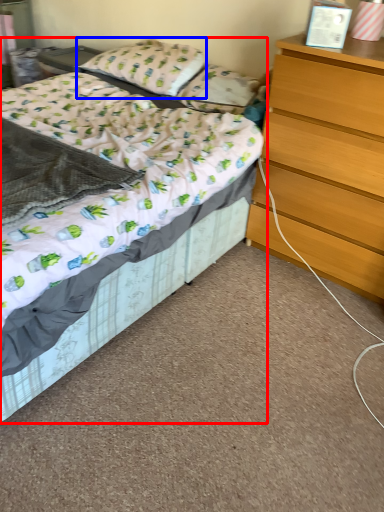
Question: Which of the following is the closest to the observer, bed (highlighted by a red box) or pillow (highlighted by a blue box)?

Choices:
 (A) bed
 (B) pillow

Answer: (A)